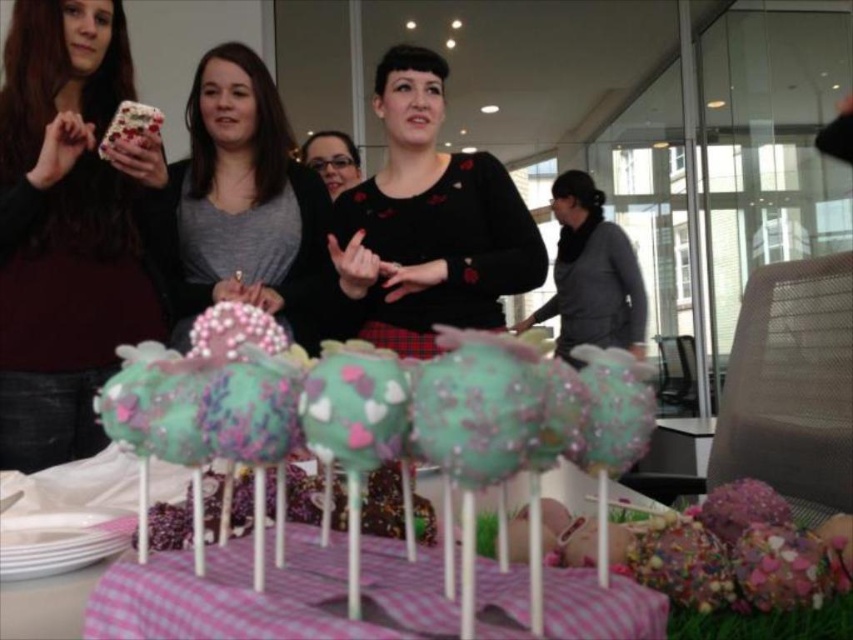
Is the position of matte gray sweater at center less distant than that of matte black glasses at center?

That is True.

Between point (323, 212) and point (322, 131), which one is positioned behind?

The point (322, 131) is behind.

Is point (273, 301) farther from viewer compared to point (346, 150)?

No, (273, 301) is closer to viewer.

Find the location of a particular element. The height and width of the screenshot is (640, 853). matte gray sweater at center is located at coordinates (244, 204).

Based on the photo, how far apart are matte black sweater at upper left and gray matte jacket at center?

matte black sweater at upper left and gray matte jacket at center are 9.43 feet apart.

Is matte black sweater at upper left behind gray matte jacket at center?

No, it is not.

Between point (15, 352) and point (593, 292), which one is positioned in front?

Positioned in front is point (15, 352).

Identify the location of matte black sweater at upper left. (68, 227).

Can you confirm if matte black sweater at upper left is taller than matte black glasses at center?

Indeed, matte black sweater at upper left has a greater height compared to matte black glasses at center.

Is matte black sweater at upper left to the left of matte black glasses at center from the viewer's perspective?

Correct, you'll find matte black sweater at upper left to the left of matte black glasses at center.

Who is more forward, (61, 113) or (322, 150)?

Positioned in front is point (61, 113).

Locate an element on the screen. This screenshot has width=853, height=640. matte black sweater at upper left is located at coordinates 68,227.